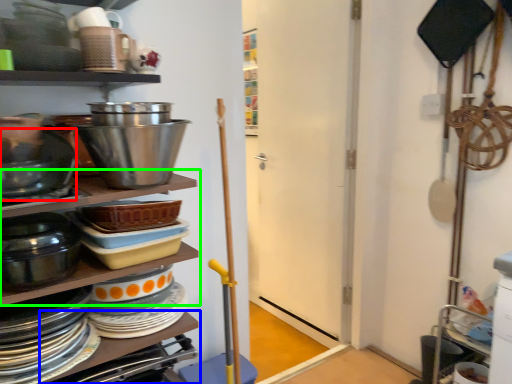
Question: Which object is the farthest from bowl (highlighted by a red box)? Choose among these: table (highlighted by a blue box) or shelf (highlighted by a green box).

Choices:
 (A) table
 (B) shelf

Answer: (A)